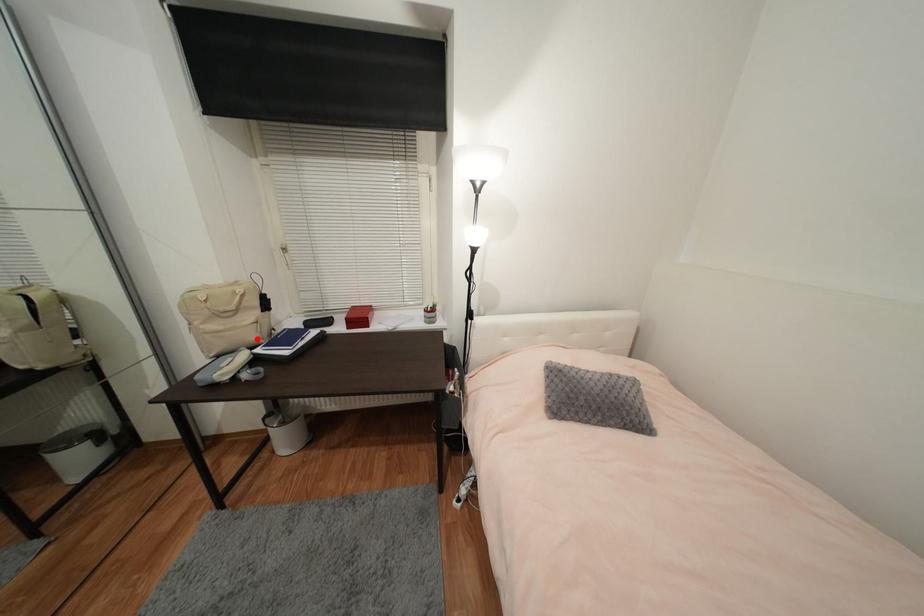
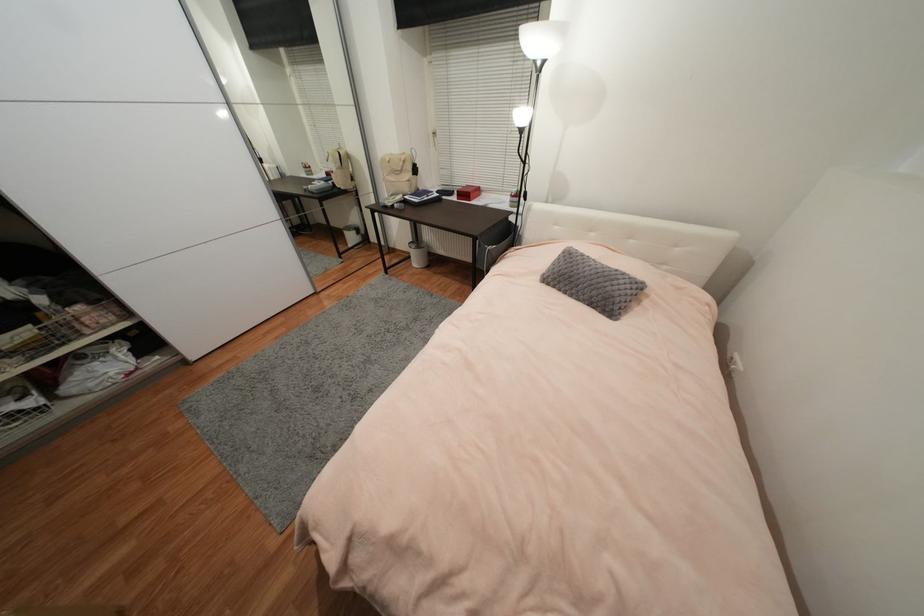
In the second image, find the point that corresponds to the highlighted location in the first image.

(410, 191)